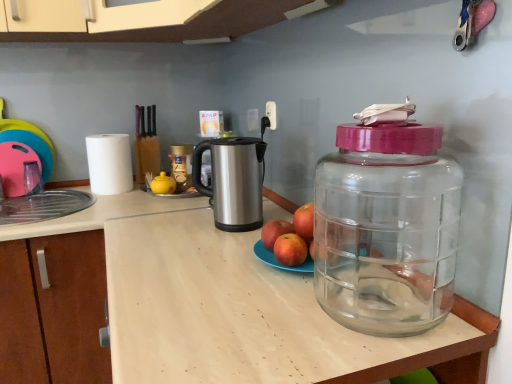
Locate an element on the screen. vacant area that lies in front of silver metallic kettle at center is located at coordinates (215, 244).